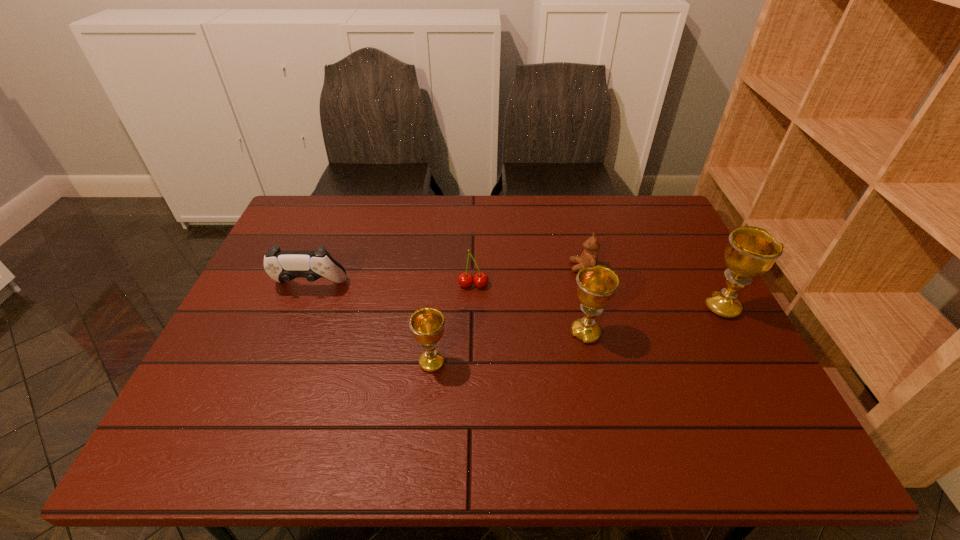
Locate an element on the screen. Image resolution: width=960 pixels, height=540 pixels. free space in the image that satisfies the following two spatial constraints: 1. on the face of the teddy bear; 2. on the front-facing side of the control is located at coordinates (588, 286).

Find the location of a particular element. This screenshot has height=540, width=960. free location that satisfies the following two spatial constraints: 1. on the back side of the second tallest chalice; 2. on the right side of the shortest chalice is located at coordinates click(x=435, y=333).